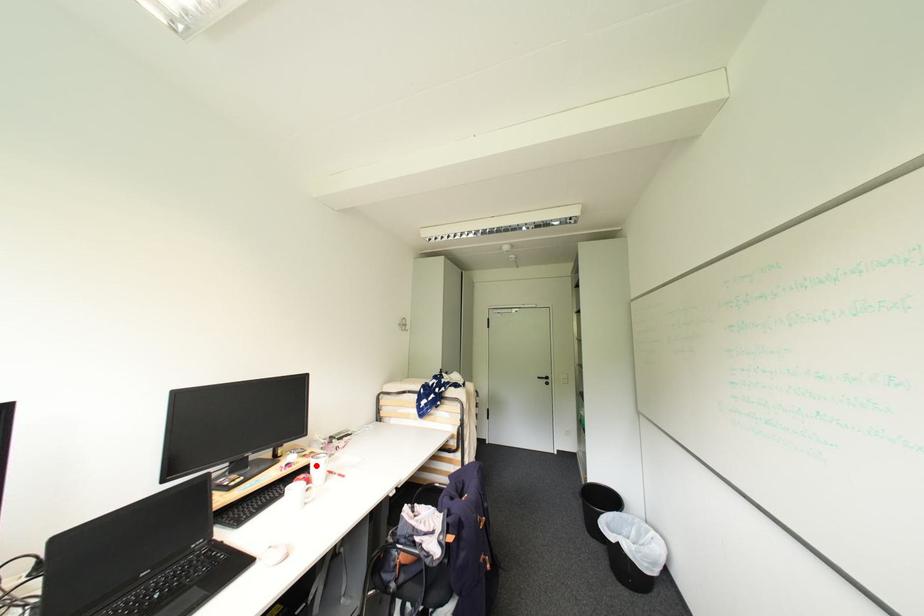
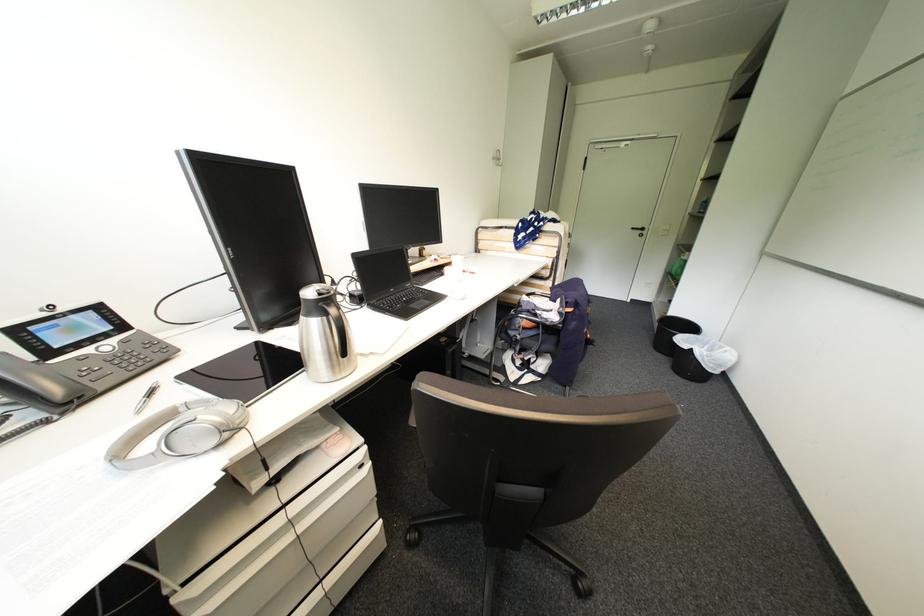
Locate, in the second image, the point that corresponds to the highlighted location in the first image.

(456, 262)